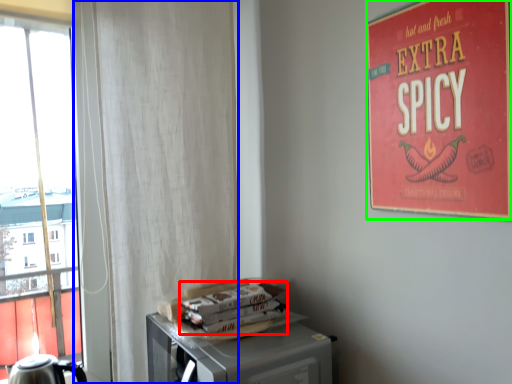
Question: Which is farther away from magazine (highlighted by a red box)? curtain (highlighted by a blue box) or poster (highlighted by a green box)?

Choices:
 (A) curtain
 (B) poster

Answer: (B)